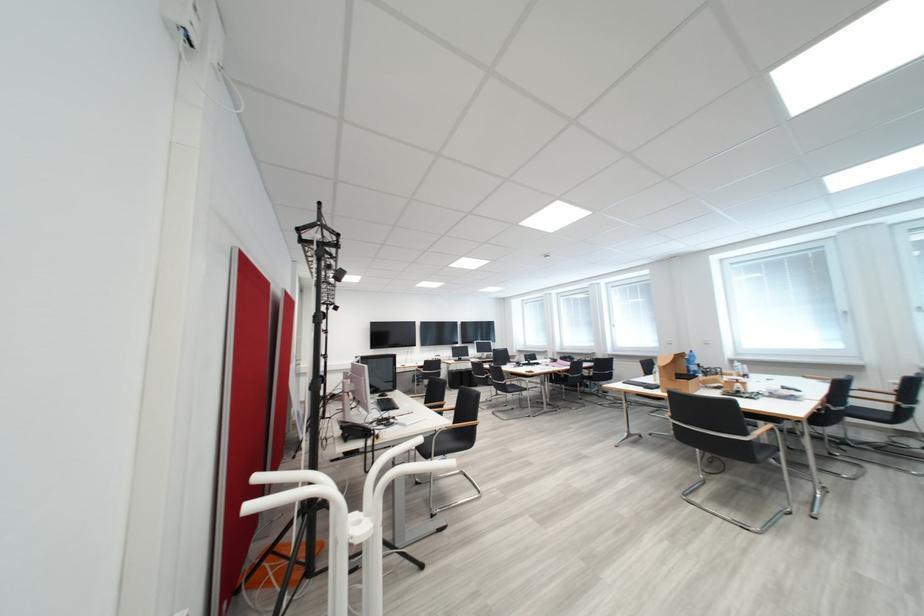
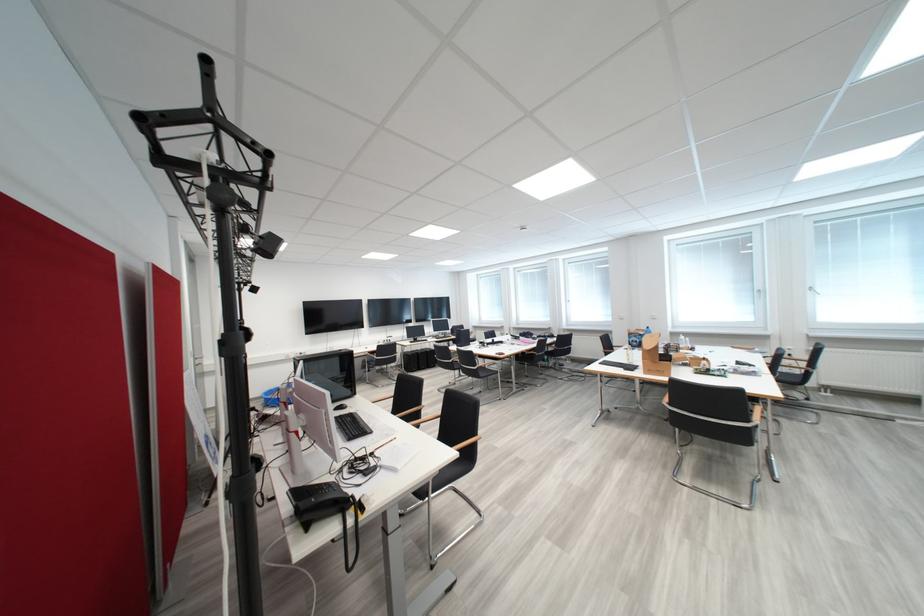
In a continuous first-person perspective shot, in which direction is the camera moving?

The movement direction of the cameraman is left, forward.